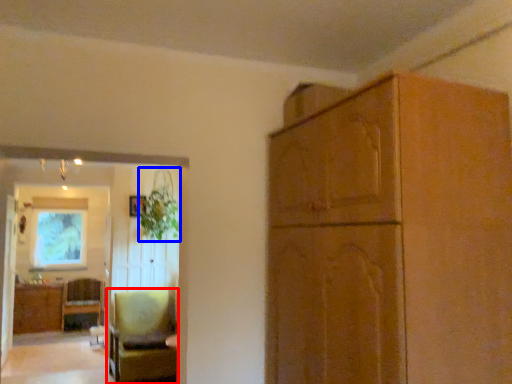
Question: Among these objects, which one is farthest to the camera, chair (highlighted by a red box) or plant (highlighted by a blue box)?

Choices:
 (A) chair
 (B) plant

Answer: (B)